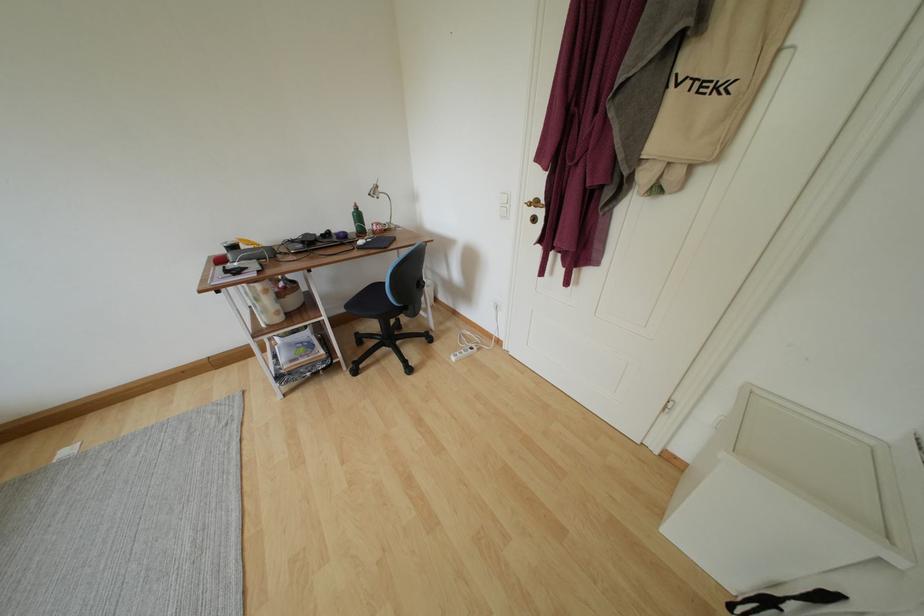
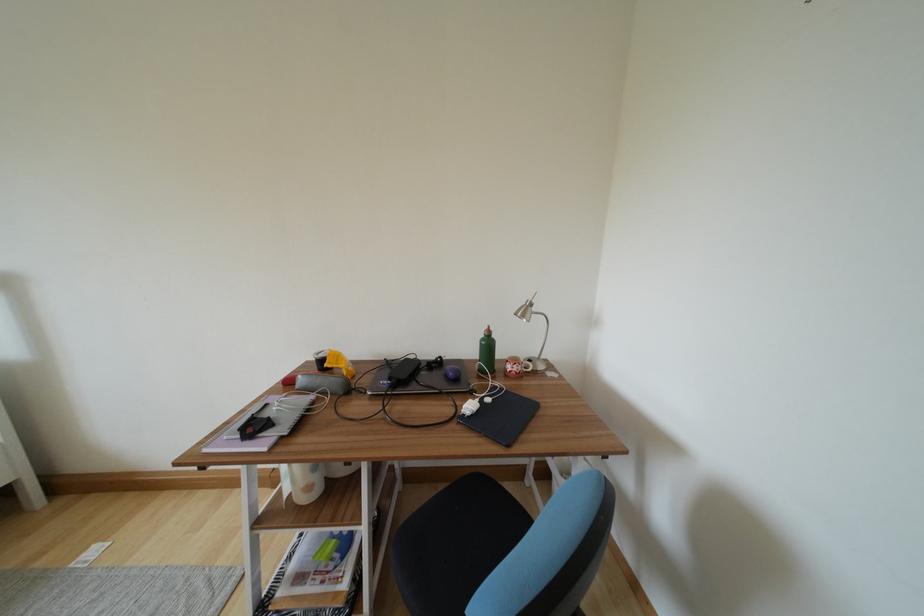
Question: The first image is from the beginning of the video and the second image is from the end. How did the camera likely rotate when shooting the video?

Choices:
 (A) Left
 (B) Right
 (C) Up
 (D) Down

Answer: (A)